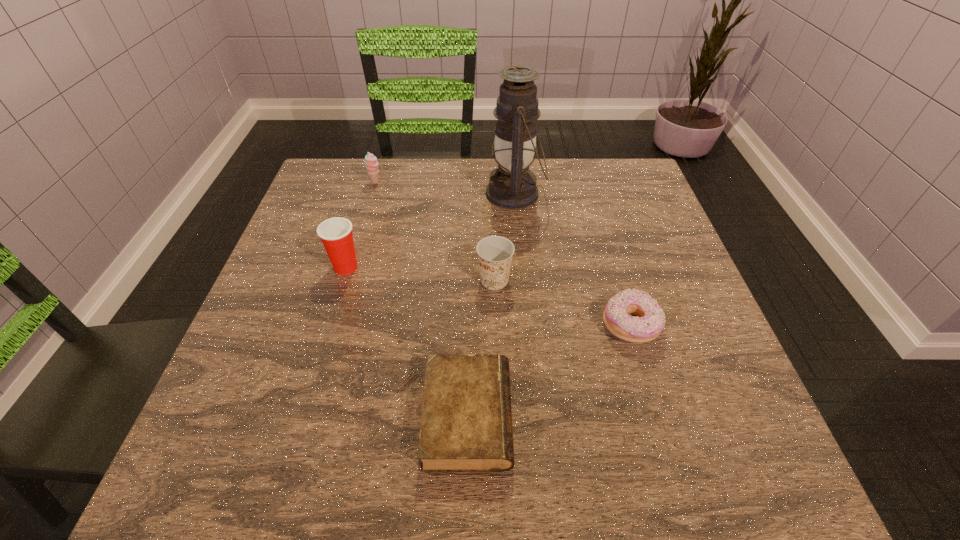
The width and height of the screenshot is (960, 540). What are the coordinates of `object located in the right edge section of the desktop` in the screenshot? It's located at (650, 321).

At what (x,y) coordinates should I click in order to perform the action: click on object that is at the far left corner. Please return your answer as a coordinate pair (x, y). This screenshot has height=540, width=960. Looking at the image, I should click on (371, 162).

In the image, there is a desktop. Identify the location of vacant space at the far edge. (550, 186).

This screenshot has height=540, width=960. I want to click on free location at the near edge of the desktop, so click(x=603, y=439).

You are a GUI agent. You are given a task and a screenshot of the screen. Output one action in this format:
    pyautogui.click(x=<x>, y=<y>)
    Task: Click on the free space at the right edge of the desktop
    This screenshot has width=960, height=540.
    Given the screenshot: What is the action you would take?
    pyautogui.click(x=688, y=315)

This screenshot has width=960, height=540. What are the coordinates of `vacant area at the far left corner` in the screenshot? It's located at (313, 199).

I want to click on vacant space at the near right corner, so click(695, 454).

You are a GUI agent. You are given a task and a screenshot of the screen. Output one action in this format:
    pyautogui.click(x=<x>, y=<y>)
    Task: Click on the vacant area that lies between the shorter Dixie cup and the rightmost object
    The width and height of the screenshot is (960, 540).
    Given the screenshot: What is the action you would take?
    pyautogui.click(x=563, y=303)

The width and height of the screenshot is (960, 540). I want to click on free spot between the left Dixie cup and the tallest object, so click(x=430, y=230).

Where is `free space between the fifth farthest object and the oil lamp`? This screenshot has width=960, height=540. free space between the fifth farthest object and the oil lamp is located at coordinates (573, 260).